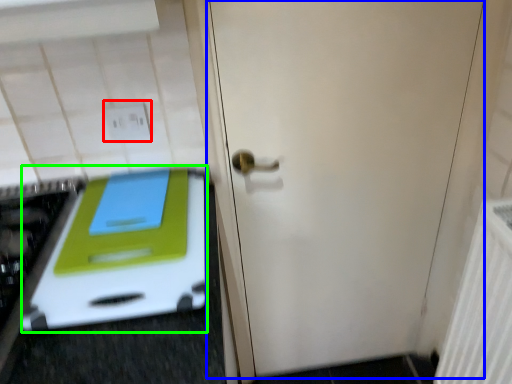
Question: Which is nearer to the electric outlet (highlighted by a red box)? door (highlighted by a blue box) or oven (highlighted by a green box).

Choices:
 (A) door
 (B) oven

Answer: (B)